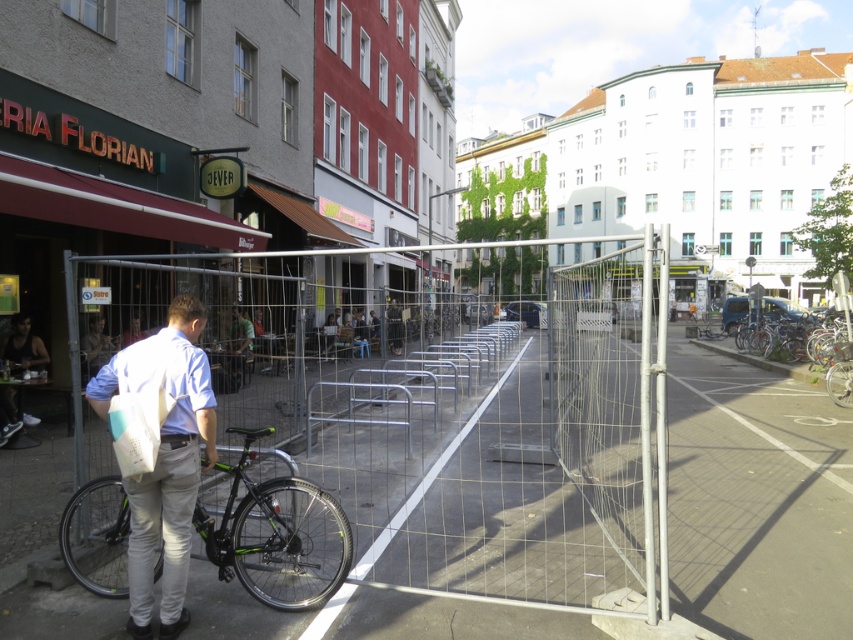
Question: Which of the following is the farthest from the observer?

Choices:
 (A) shiny metallic bicycle at right
 (B) matte black jacket at center

Answer: (B)

Question: Can you confirm if dark brown leather jacket at lower left is thinner than matte black jacket at center?

Choices:
 (A) no
 (B) yes

Answer: (A)

Question: Which point is farther to the camera?

Choices:
 (A) (699, 346)
 (B) (15, 394)
 (C) (260, 596)
 (D) (599, 572)

Answer: (A)

Question: Estimate the real-world distances between objects in this image. Which object is closer to the light blue shirt at center?

Choices:
 (A) dark brown leather jacket at lower left
 (B) green matte bicycle at left
 (C) matte black jacket at center

Answer: (A)

Question: Is green matte bicycle at left below matte black jacket at center?

Choices:
 (A) no
 (B) yes

Answer: (B)

Question: Is dark brown leather jacket at lower left below light blue shirt at center?

Choices:
 (A) yes
 (B) no

Answer: (A)